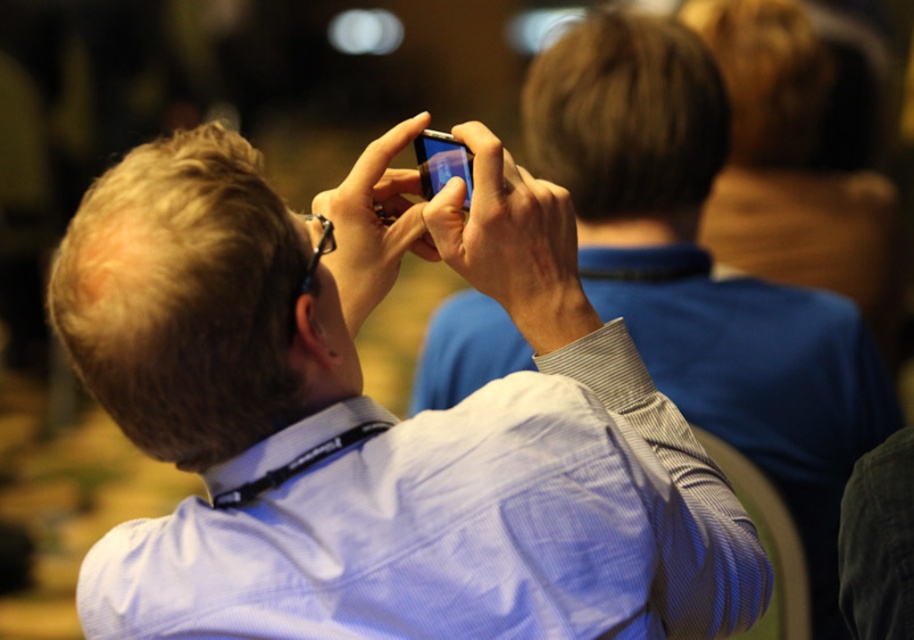
Question: Among these objects, which one is nearest to the camera?

Choices:
 (A) matte black phone at upper center
 (B) matte blue shirt at center

Answer: (A)

Question: Is matte black phone at upper center smaller than matte blue shirt at center?

Choices:
 (A) yes
 (B) no

Answer: (A)

Question: Is matte black phone at upper center thinner than matte black smartphone at center?

Choices:
 (A) yes
 (B) no

Answer: (B)

Question: Does matte black phone at upper center have a larger size compared to matte blue shirt at center?

Choices:
 (A) yes
 (B) no

Answer: (B)

Question: Among these points, which one is farthest from the camera?

Choices:
 (A) (490, 477)
 (B) (441, 154)
 (C) (696, 259)

Answer: (C)

Question: Which object is the farthest from the matte black phone at upper center?

Choices:
 (A) matte blue shirt at center
 (B) matte black smartphone at center

Answer: (A)